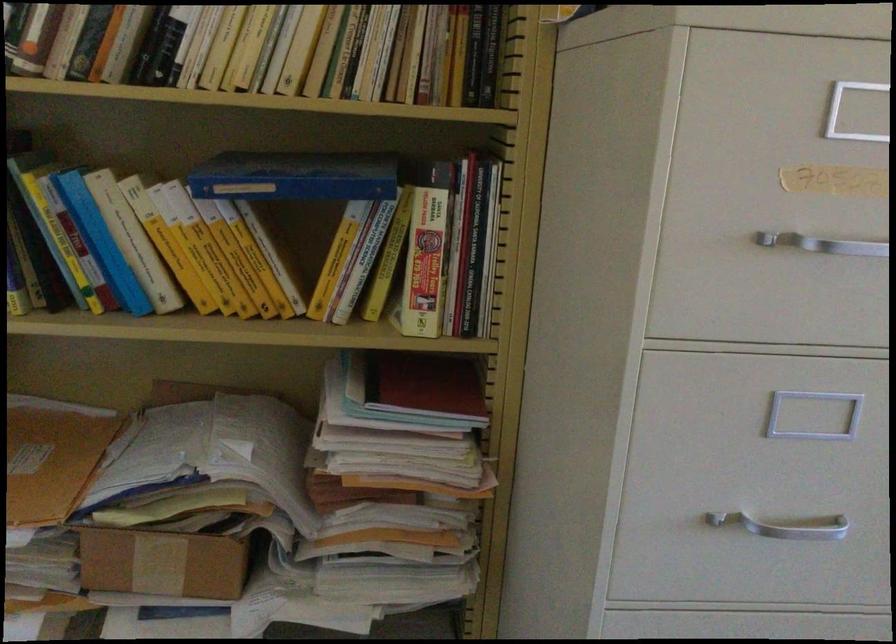
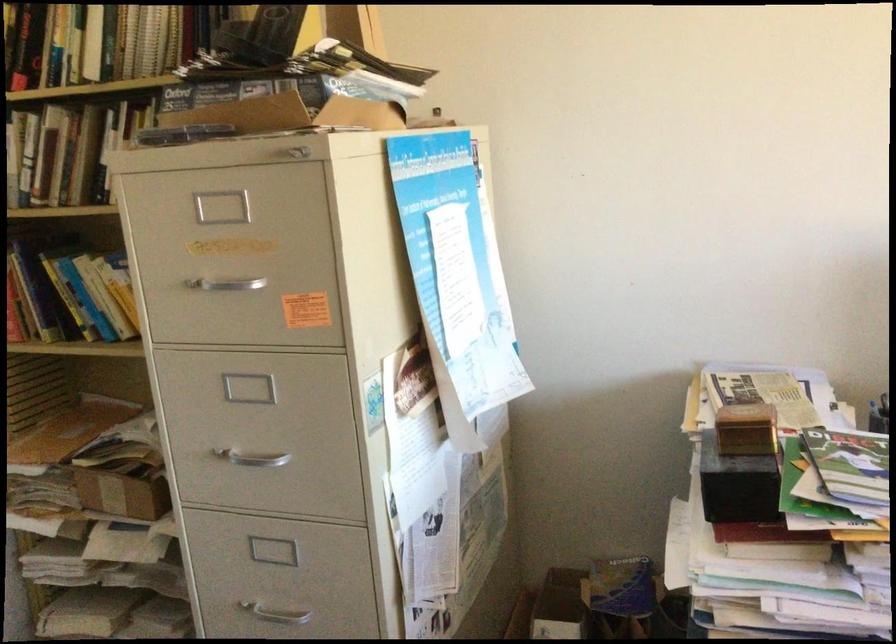
Question: What movement of the cameraman would produce the second image?

Choices:
 (A) Left
 (B) Right
 (C) Forward
 (D) Backward

Answer: (B)